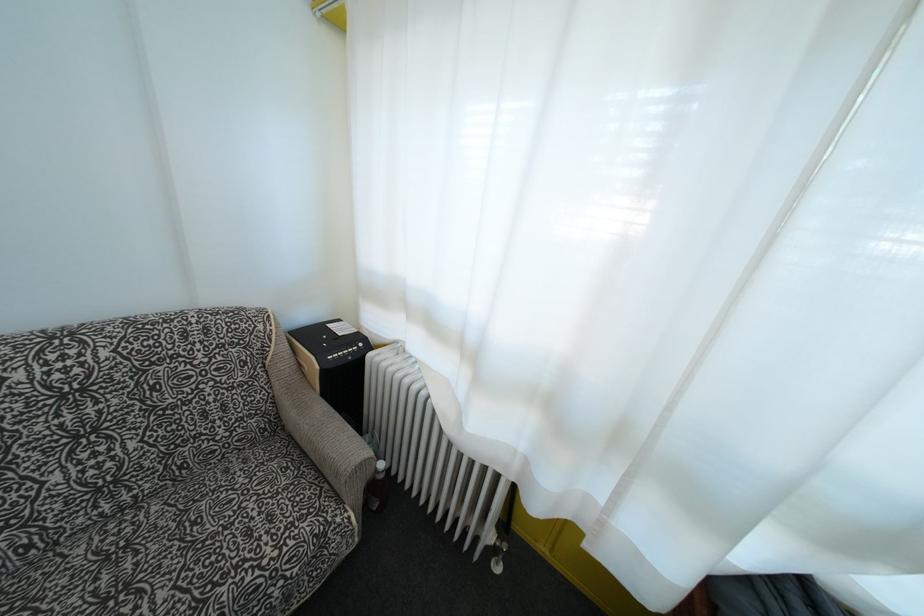
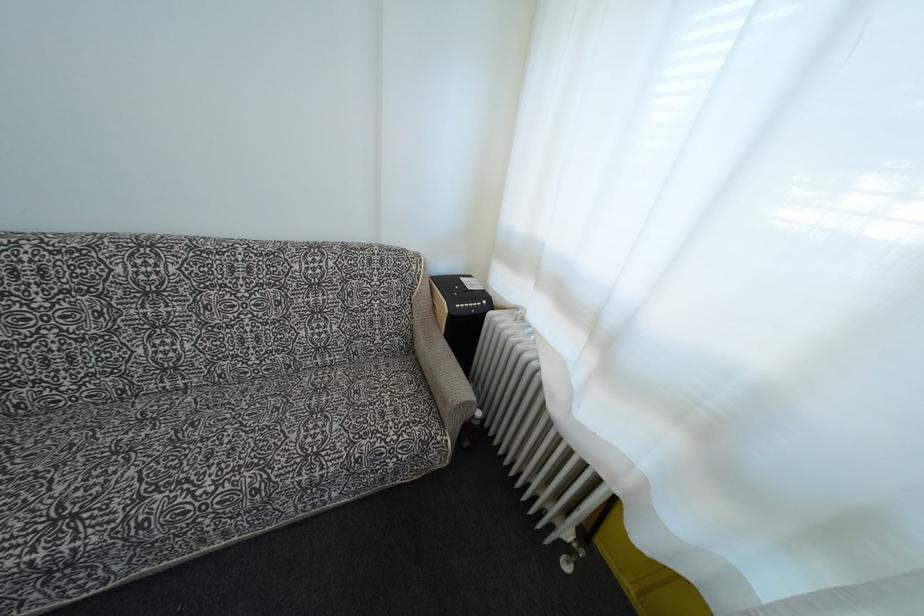
Where in the second image is the point corresponding to the point at 370,467 from the first image?

(472, 408)